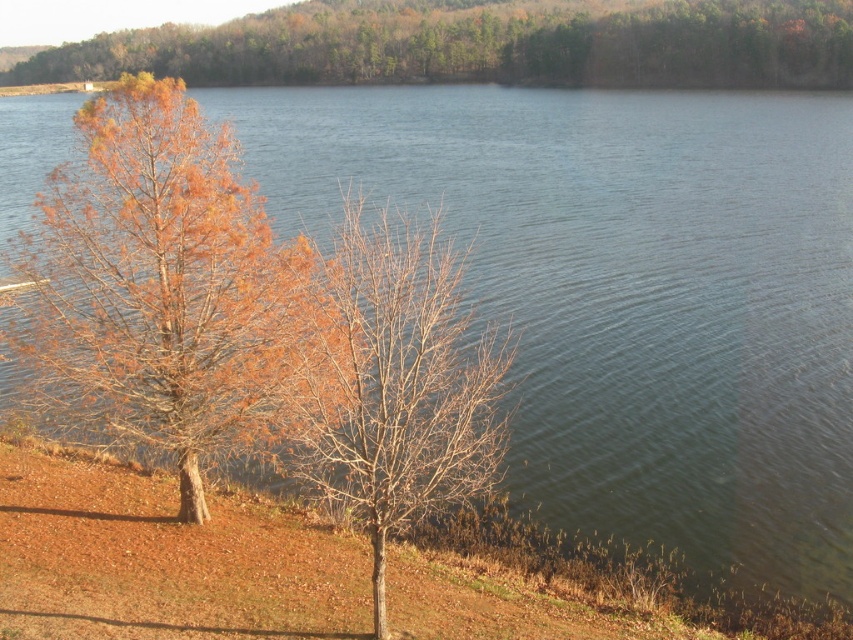
Question: Based on their relative distances, which object is nearer to the brown leafy tree at upper center?

Choices:
 (A) orange-brown wood tree at left
 (B) bare branches at center

Answer: (A)

Question: Can you confirm if orange-brown wood tree at left is wider than brown leafy tree at upper center?

Choices:
 (A) yes
 (B) no

Answer: (B)

Question: Can you confirm if orange-brown wood tree at left is positioned to the left of brown leafy tree at upper center?

Choices:
 (A) no
 (B) yes

Answer: (A)

Question: Is the position of orange-brown wood tree at left less distant than that of brown leafy tree at upper center?

Choices:
 (A) no
 (B) yes

Answer: (B)

Question: Among these objects, which one is farthest from the camera?

Choices:
 (A) orange-brown wood tree at left
 (B) bare branches at center
 (C) brown leafy tree at upper center

Answer: (C)

Question: Which point is closer to the camera?

Choices:
 (A) orange-brown wood tree at left
 (B) bare branches at center

Answer: (B)